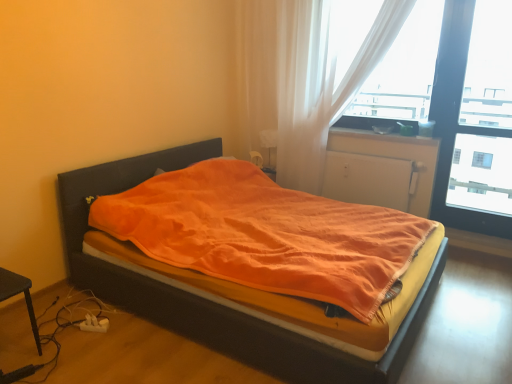
The image size is (512, 384). What do you see at coordinates (94, 324) in the screenshot?
I see `white plastic charger at lower left` at bounding box center [94, 324].

Measure the distance between point (205, 334) and camera.

The depth of point (205, 334) is 2.30 meters.

What do you see at coordinates (368, 179) in the screenshot? I see `white matte radiator at center` at bounding box center [368, 179].

Where is `matte plastic window sill at upper right`? matte plastic window sill at upper right is located at coordinates (379, 126).

What do you see at coordinates (485, 115) in the screenshot?
I see `transparent glass window at upper right` at bounding box center [485, 115].

Identify the location of white sheer curtain at upper right, the 1th curtain viewed from the right. (370, 53).

From a real-world perspective, between orange fabric bed at center and translucent white curtain at upper right, placed as the 1th curtain when sorted from left to right, who is vertically higher?

translucent white curtain at upper right, placed as the 1th curtain when sorted from left to right.

Considering the positions of point (157, 309) and point (326, 124), is point (157, 309) closer or farther from the camera than point (326, 124)?

Point (157, 309) is closer to the camera than point (326, 124).

Choose the correct answer: Is orange fabric bed at center inside translucent white curtain at upper right, marked as the 2th curtain in a right-to-left arrangement, or outside it?

orange fabric bed at center cannot be found inside translucent white curtain at upper right, marked as the 2th curtain in a right-to-left arrangement.

From the image's perspective, which one is positioned higher, orange fabric bed at center or translucent white curtain at upper right, marked as the 2th curtain in a right-to-left arrangement?

translucent white curtain at upper right, marked as the 2th curtain in a right-to-left arrangement.

Is the depth of white matte radiator at center greater than that of orange fabric bed at center?

Yes, white matte radiator at center is further from the camera.

In the scene shown: Can you confirm if white matte radiator at center is positioned to the left of orange fabric bed at center?

No.

Can you tell me how much white matte radiator at center and orange fabric bed at center differ in facing direction?

90 degrees separate the facing orientations of white matte radiator at center and orange fabric bed at center.

From the image's perspective, which one is positioned higher, white sheer curtain at upper right, the 1th curtain viewed from the right, or white matte radiator at center?

white sheer curtain at upper right, the 1th curtain viewed from the right, appears higher in the image.

Does point (380, 13) come farther from viewer compared to point (347, 201)?

No, (380, 13) is closer to viewer.

Consider the image. How many degrees apart are the facing directions of white sheer curtain at upper right, the 2th curtain from the left, and white matte radiator at center?

0.0396 degrees.

Locate an element on the screen. Image resolution: width=512 pixels, height=384 pixels. curtain that is the 2nd object above the white matte radiator at center (from a real-world perspective) is located at coordinates (370, 53).

Does point (482, 160) come closer to viewer compared to point (391, 125)?

That is False.

Is the surface of transparent glass window at upper right in direct contact with matte plastic window sill at upper right?

They are not placed beside each other.

Looking at this image, from a real-world perspective, is transparent glass window at upper right below matte plastic window sill at upper right?

No, from a real-world perspective, transparent glass window at upper right is not under matte plastic window sill at upper right.

Who is bigger, translucent white curtain at upper right, placed as the 1th curtain when sorted from left to right, or transparent glass window at upper right?

translucent white curtain at upper right, placed as the 1th curtain when sorted from left to right, is bigger.

From a real-world perspective, which is physically below, translucent white curtain at upper right, placed as the 1th curtain when sorted from left to right, or transparent glass window at upper right?

transparent glass window at upper right is physically lower.

Identify the location of window screen located on the right of translucent white curtain at upper right, placed as the 1th curtain when sorted from left to right. (485, 115).

Which object is thinner, white matte radiator at center or transparent glass window at upper right?

With smaller width is white matte radiator at center.

Consider the image. Considering the relative sizes of white matte radiator at center and transparent glass window at upper right in the image provided, is white matte radiator at center taller than transparent glass window at upper right?

In fact, white matte radiator at center may be shorter than transparent glass window at upper right.

From a real-world perspective, is white matte radiator at center under transparent glass window at upper right?

Correct, in the physical world, white matte radiator at center is lower than transparent glass window at upper right.

From a real-world perspective, who is located higher, white sheer curtain at upper right, the 2th curtain from the left, or matte plastic window sill at upper right?

white sheer curtain at upper right, the 2th curtain from the left, from a real-world perspective.

How distant is white sheer curtain at upper right, the 2th curtain from the left, from matte plastic window sill at upper right?

white sheer curtain at upper right, the 2th curtain from the left, is 53.90 centimeters away from matte plastic window sill at upper right.

From the image's perspective, is white sheer curtain at upper right, the 2th curtain from the left, above matte plastic window sill at upper right?

Indeed, from the image's perspective, white sheer curtain at upper right, the 2th curtain from the left, is shown above matte plastic window sill at upper right.

Is white sheer curtain at upper right, the 2th curtain from the left, to the left of matte plastic window sill at upper right from the viewer's perspective?

No, white sheer curtain at upper right, the 2th curtain from the left, is not to the left of matte plastic window sill at upper right.

From the image's perspective, which curtain is the 1st one above the orange fabric bed at center? Please provide its 2D coordinates.

[(303, 79)]

Where is `screen door that is behind the orange fabric bed at center`? screen door that is behind the orange fabric bed at center is located at coordinates (368, 179).

Looking at the image, which one is located further to orange fabric bed at center, white plastic charger at lower left or translucent white curtain at upper right, marked as the 2th curtain in a right-to-left arrangement?

Based on the image, translucent white curtain at upper right, marked as the 2th curtain in a right-to-left arrangement, appears to be further to orange fabric bed at center.

Which object lies nearer to the anchor point orange fabric bed at center, transparent glass window at upper right or white sheer curtain at upper right, the 2th curtain from the left?

white sheer curtain at upper right, the 2th curtain from the left, is positioned closer to the anchor orange fabric bed at center.

Based on their spatial positions, is white sheer curtain at upper right, the 2th curtain from the left, or white plastic charger at lower left further from white matte radiator at center?

white plastic charger at lower left lies further to white matte radiator at center than the other object.

Considering their positions, is white plastic charger at lower left positioned further to transparent glass window at upper right than white matte radiator at center?

Among the two, white plastic charger at lower left is located further to transparent glass window at upper right.

Considering their positions, is transparent glass window at upper right positioned further to white plastic charger at lower left than white matte radiator at center?

Based on the image, transparent glass window at upper right appears to be further to white plastic charger at lower left.

When comparing their distances from white plastic charger at lower left, does white sheer curtain at upper right, the 1th curtain viewed from the right, or transparent glass window at upper right seem further?

Based on the image, transparent glass window at upper right appears to be further to white plastic charger at lower left.

Estimate the real-world distances between objects in this image. Which object is further from matte plastic window sill at upper right, transparent glass window at upper right or white plastic charger at lower left?

The object further to matte plastic window sill at upper right is white plastic charger at lower left.

Based on their spatial positions, is white matte radiator at center or matte plastic window sill at upper right closer to transparent glass window at upper right?

white matte radiator at center is closer to transparent glass window at upper right.

Where is `curtain located between translucent white curtain at upper right, marked as the 2th curtain in a right-to-left arrangement, and transparent glass window at upper right in the left-right direction`? The image size is (512, 384). curtain located between translucent white curtain at upper right, marked as the 2th curtain in a right-to-left arrangement, and transparent glass window at upper right in the left-right direction is located at coordinates point(370,53).

I want to click on window sill between white sheer curtain at upper right, the 2th curtain from the left, and white matte radiator at center in the up-down direction, so click(x=379, y=126).

Locate an element on the screen. window screen positioned between orange fabric bed at center and white matte radiator at center from near to far is located at coordinates (485, 115).

Find the location of a particular element. This screenshot has height=384, width=512. curtain between matte plastic window sill at upper right and transparent glass window at upper right in the horizontal direction is located at coordinates (370, 53).